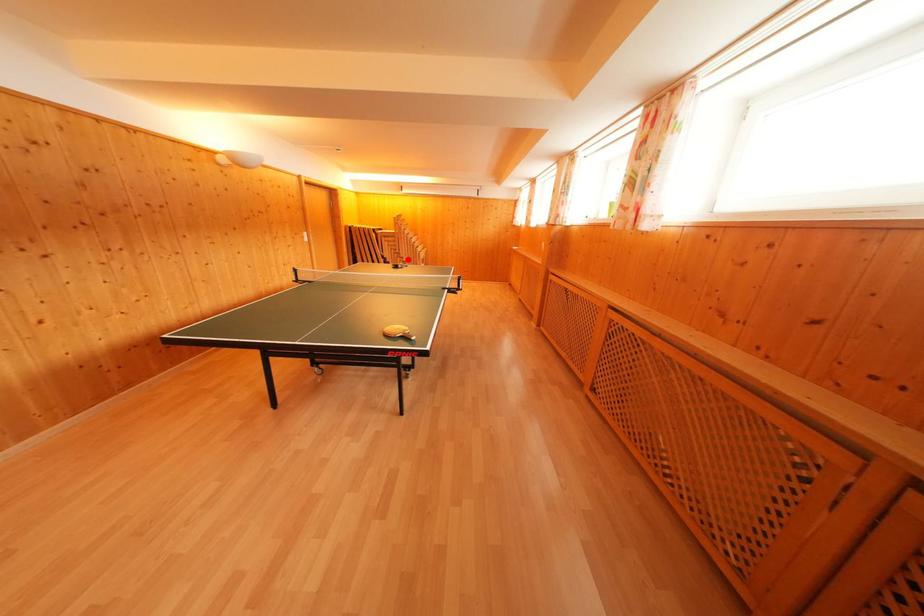
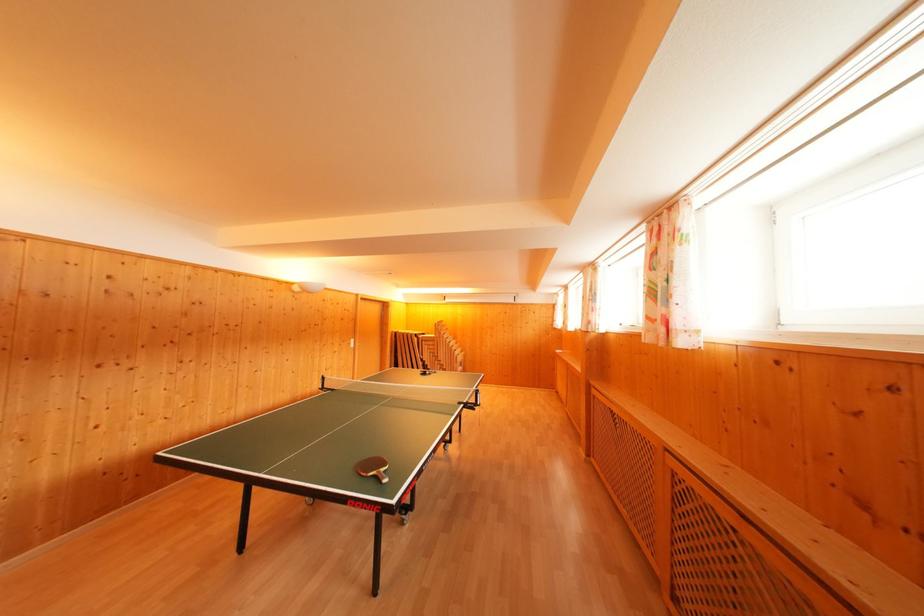
Question: I am providing you with two images of the same scene from different viewpoints. Image1 has a red point marked. In image2, the corresponding 3D location appears at what relative position? Reply with the corresponding letter.

Choices:
 (A) Closer
 (B) Farther

Answer: (B)